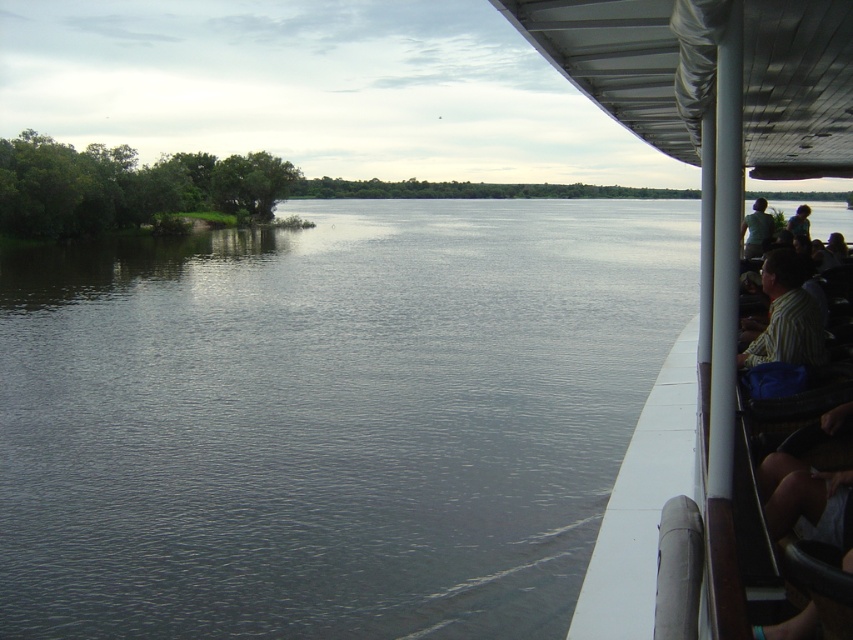
Does white plastic boat at right have a greater width compared to green fabric shirt at upper right?

Yes, white plastic boat at right is wider than green fabric shirt at upper right.

Is white plastic boat at right thinner than green fabric shirt at upper right?

No.

The width and height of the screenshot is (853, 640). Describe the element at coordinates (700, 285) in the screenshot. I see `white plastic boat at right` at that location.

Where is `white plastic boat at right`? The height and width of the screenshot is (640, 853). white plastic boat at right is located at coordinates (700, 285).

Is striped shirt at right further to camera compared to green fabric shirt at upper right?

Yes, striped shirt at right is further from the viewer.

Is point (799, 337) closer to camera compared to point (764, 204)?

Yes, point (799, 337) is closer to viewer.

Between point (770, 346) and point (763, 236), which one is positioned behind?

The point (763, 236) is more distant.

At what (x,y) coordinates should I click in order to perform the action: click on striped shirt at right. Please return your answer as a coordinate pair (x, y). Image resolution: width=853 pixels, height=640 pixels. Looking at the image, I should click on (786, 316).

Can you confirm if white plastic boat at right is bigger than striped shirt at right?

Indeed, white plastic boat at right has a larger size compared to striped shirt at right.

Is point (567, 58) behind point (781, 308)?

No, it is in front of (781, 308).

In order to click on white plastic boat at right in this screenshot , I will do `click(700, 285)`.